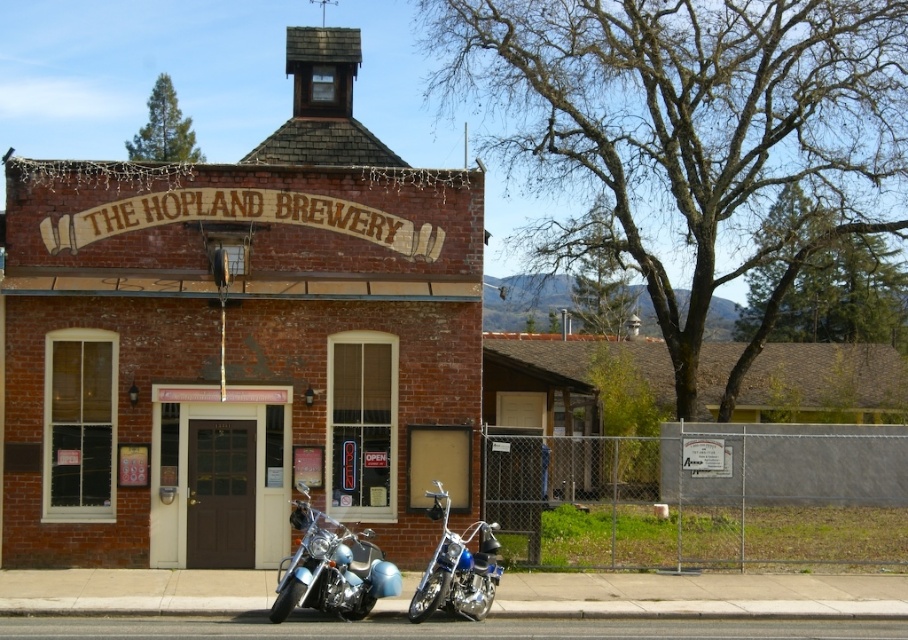
Locate an element on the screen. The image size is (908, 640). brown wooden door at center is located at coordinates (221, 476).

Which of these two, brown wooden door at center or shiny chrome motorcycle at center, stands taller?

With more height is brown wooden door at center.

Locate an element on the screen. brown wooden door at center is located at coordinates 221,476.

Measure the distance between point (205, 540) and camera.

Point (205, 540) and camera are 54.64 feet apart from each other.

Who is more distant from viewer, (248, 444) or (300, 582)?

The point (248, 444) is more distant.

I want to click on brown wooden door at center, so click(x=221, y=476).

Is shiny chrome motorcycle at lower center above shiny chrome motorcycle at center?

Yes, shiny chrome motorcycle at lower center is above shiny chrome motorcycle at center.

Between point (314, 538) and point (427, 564), which one is positioned behind?

Point (427, 564)

Locate an element on the screen. shiny chrome motorcycle at lower center is located at coordinates (332, 570).